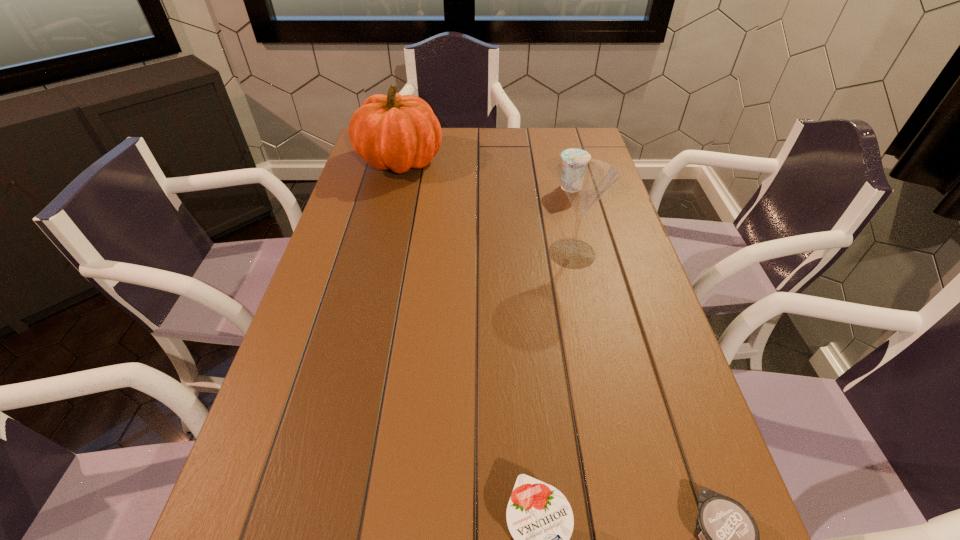
The width and height of the screenshot is (960, 540). I want to click on object that is at the far left corner, so click(x=398, y=132).

Find the location of `blank space at the far edge of the desktop`. blank space at the far edge of the desktop is located at coordinates (545, 149).

Locate an element on the screen. Image resolution: width=960 pixels, height=540 pixels. vacant space at the left edge of the desktop is located at coordinates (x=307, y=429).

In the image, there is a desktop. Identify the location of free space at the right edge. The height and width of the screenshot is (540, 960). (629, 272).

Locate an element on the screen. This screenshot has width=960, height=540. free space between the pumpkin and the second yogurt from left to right is located at coordinates (486, 174).

What are the coordinates of `vacant area between the second yogurt from right to left and the third nearest object` in the screenshot? It's located at (571, 221).

What are the coordinates of `vacant area that lies between the pumpkin and the third nearest object` in the screenshot? It's located at (486, 207).

The image size is (960, 540). In order to click on vacant area between the leftmost object and the second yogurt from left to right in this screenshot , I will do `click(486, 174)`.

Identify the location of unoccupied area between the flute glass and the second yogurt from right to left. Image resolution: width=960 pixels, height=540 pixels. (571, 221).

At what (x,y) coordinates should I click in order to perform the action: click on the second closest object to the shortest object. Please return your answer as a coordinate pair (x, y). The image size is (960, 540). Looking at the image, I should click on click(585, 180).